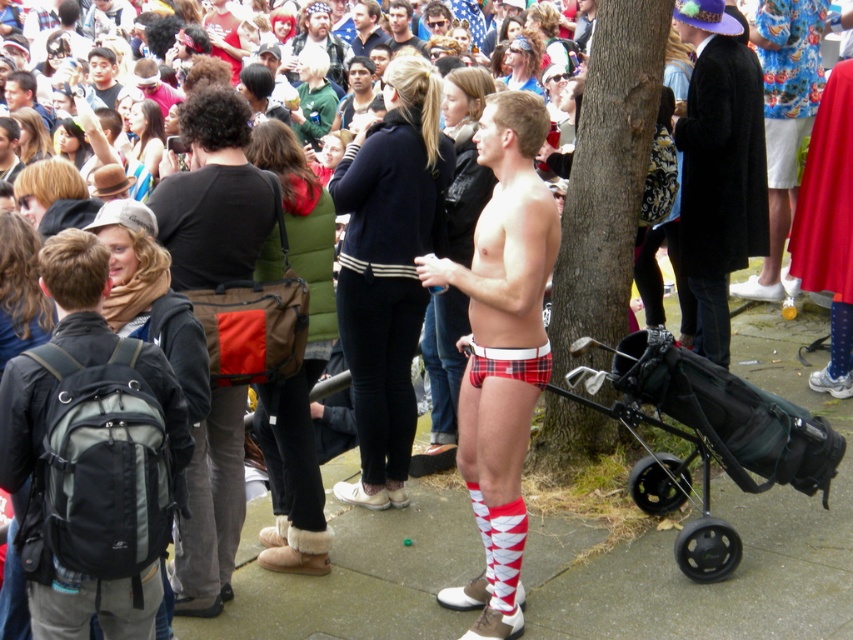
You are a photographer trying to focus on two points in the image. The first point is at coordinate point (488, 280) and the second is at point (242, 141). Which point should you focus on first to ensure the foreground subject is sharp?

Point (488, 280) is closer to the camera than point (242, 141), so you should focus on point (488, 280) first to ensure the foreground subject is sharp.

You are a photographer standing at the center of the scene. You want to take a photo of the man in plaid boxer shorts and red argyle socks. Your camera is at your side. The black fabric backpack at lower left is blocking your view. Can you reach the camera in time to take the photo before the man moves?

The black fabric backpack at lower left and camera are 12.62 feet apart from each other. Since the backpack is blocking your view and the camera is 12.62 feet away, you would need to move quickly to retrieve the camera before the man moves.

Based on the scene description, can you determine which item is visible on top of the other between the plaid fabric shorts at center and the dark brown leather jacket at center?

The plaid fabric shorts at center is positioned over the dark brown leather jacket at center, so the plaid fabric shorts at center is visible on top.